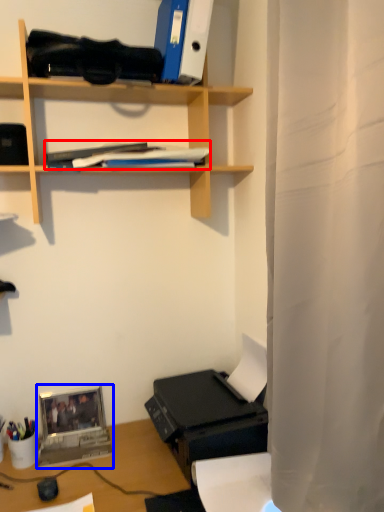
Question: Which point is closer to the camera, book (highlighted by a red box) or laptop (highlighted by a blue box)?

Choices:
 (A) book
 (B) laptop

Answer: (A)